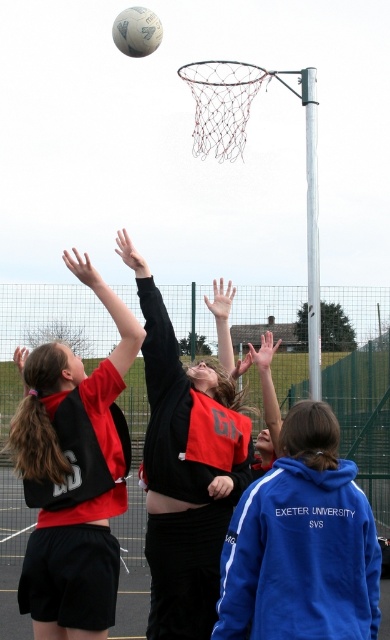
Question: Which point appears farthest from the camera in this image?

Choices:
 (A) (134, 13)
 (B) (56, 458)

Answer: (A)

Question: Does black jersey at upper left appear on the right side of white matte volleyball at upper center?

Choices:
 (A) yes
 (B) no

Answer: (B)

Question: Among these points, which one is nearest to the camera?

Choices:
 (A) (189, 451)
 (B) (127, 29)
 (C) (35, 385)
 (D) (303, 534)

Answer: (D)

Question: Is the position of blue fleece jacket at lower right less distant than that of black jersey at center?

Choices:
 (A) no
 (B) yes

Answer: (B)

Question: Which object is positioned farthest from the white matte volleyball at upper center?

Choices:
 (A) black jersey at upper left
 (B) blue fleece jacket at lower right

Answer: (B)

Question: Does blue fleece jacket at lower right have a smaller size compared to white matte volleyball at upper center?

Choices:
 (A) no
 (B) yes

Answer: (B)